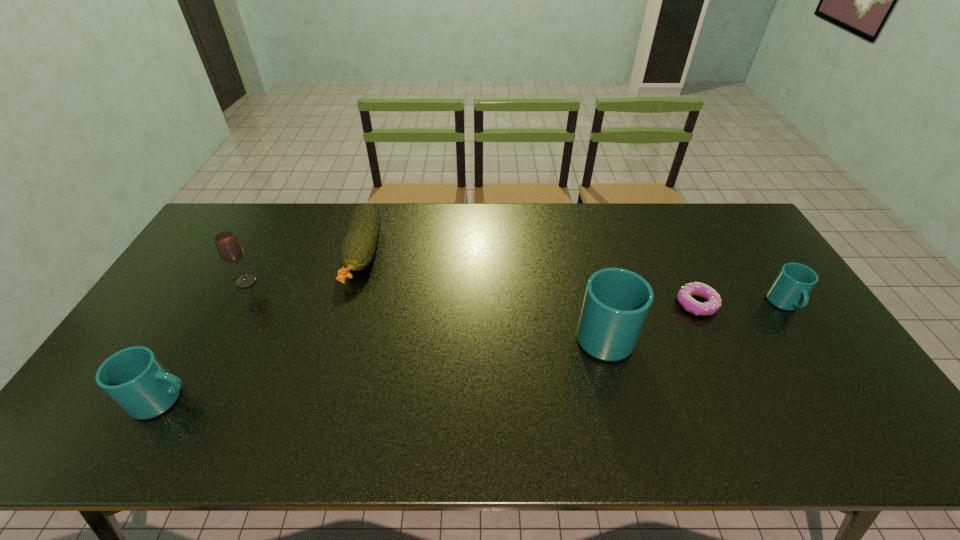
You are a GUI agent. You are given a task and a screenshot of the screen. Output one action in this format:
    pyautogui.click(x=<x>, y=<y>)
    Task: Click on the unoccupied position between the cucumber and the nearest cup
    
    Given the screenshot: What is the action you would take?
    pyautogui.click(x=263, y=327)

I want to click on vacant space that is in between the cucumber and the doughnut, so coord(529,279).

Where is `free space that is in between the nearest cup and the shortest cup`? free space that is in between the nearest cup and the shortest cup is located at coordinates (474, 352).

You are a GUI agent. You are given a task and a screenshot of the screen. Output one action in this format:
    pyautogui.click(x=<x>, y=<y>)
    Task: Click on the blank region between the nearest object and the doughnut
    This screenshot has width=960, height=540.
    Given the screenshot: What is the action you would take?
    pyautogui.click(x=430, y=352)

I want to click on free space that is in between the nearest cup and the third object from left to right, so click(263, 327).

The height and width of the screenshot is (540, 960). In order to click on free spot between the second tallest cup and the glass drink container in this screenshot , I will do `click(204, 341)`.

Where is `empty location between the cucumber and the rightmost cup`? The image size is (960, 540). empty location between the cucumber and the rightmost cup is located at coordinates (573, 279).

Locate which object is the second closest to the cucumber. Please provide its 2D coordinates. Your answer should be formatted as a tuple, i.e. [(x, y)], where the tuple contains the x and y coordinates of a point satisfying the conditions above.

[(135, 378)]

The height and width of the screenshot is (540, 960). What are the coordinates of `the second closest object to the cucumber` in the screenshot? It's located at (135, 378).

I want to click on the closest cup to the tallest cup, so click(789, 291).